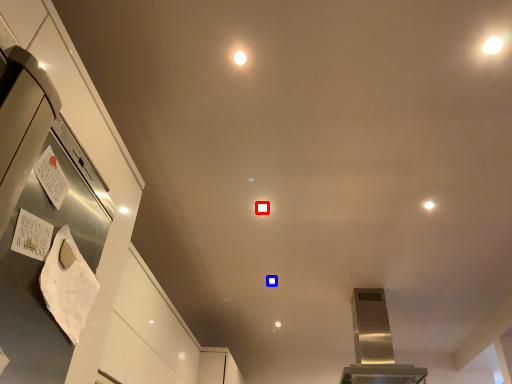
Question: Which object appears farthest to the camera in this image, light (highlighted by a red box) or light (highlighted by a blue box)?

Choices:
 (A) light
 (B) light

Answer: (B)